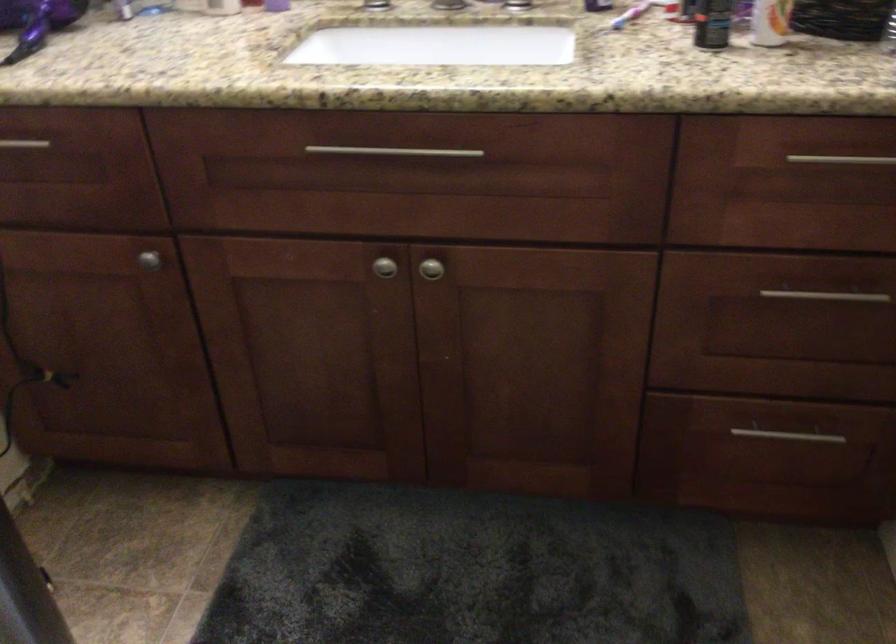
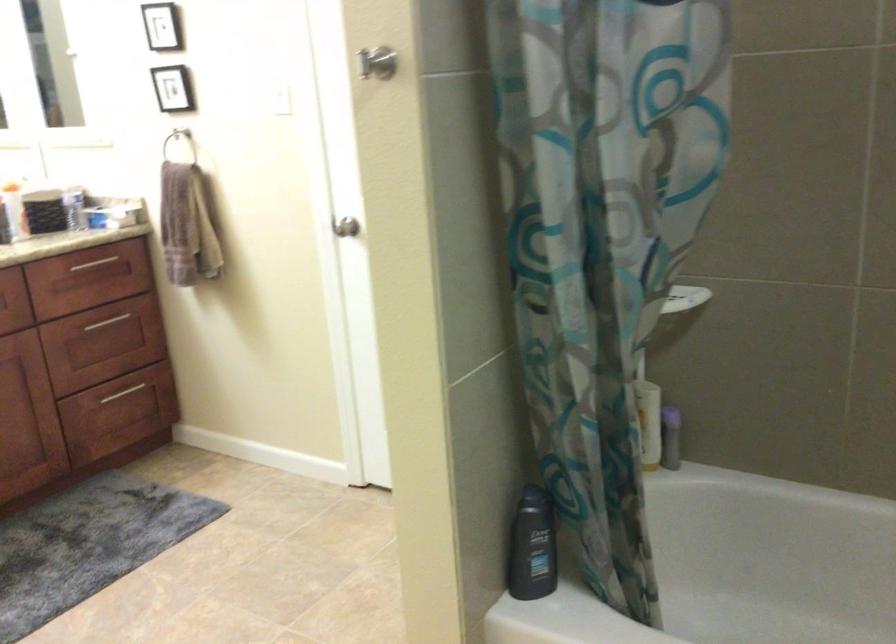
Where in the second image is the point corresponding to point 816,306 from the first image?

(115, 323)